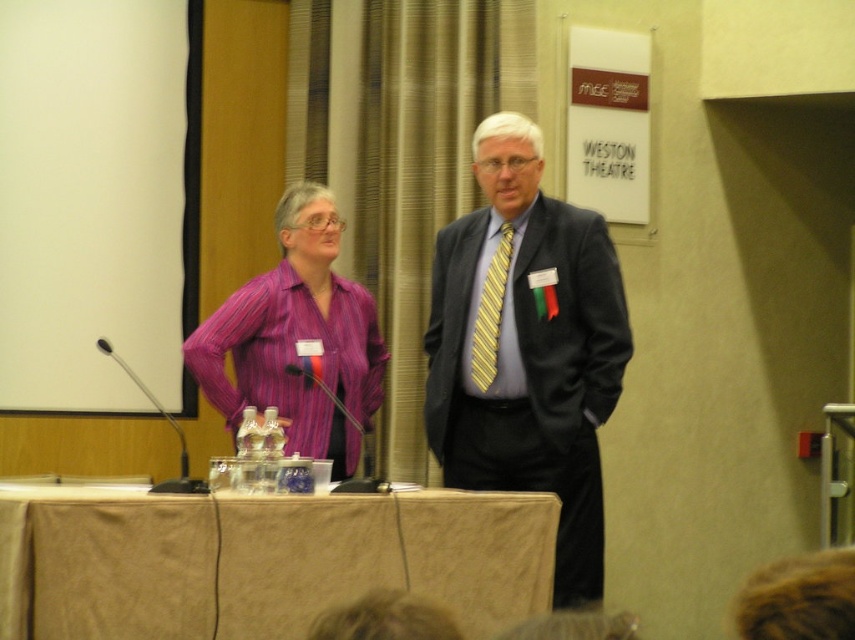
Question: Which of the following is the closest to the observer?

Choices:
 (A) matte black suit at center
 (B) yellow striped tie at center
 (C) beige fabric table at lower center

Answer: (C)

Question: Is beige fabric table at lower center below purple striped shirt at center?

Choices:
 (A) yes
 (B) no

Answer: (A)

Question: Which object appears farthest from the camera in this image?

Choices:
 (A) yellow striped tie at center
 (B) beige fabric table at lower center
 (C) purple striped shirt at center
 (D) matte black suit at center

Answer: (A)

Question: Is beige fabric table at lower center smaller than purple striped shirt at center?

Choices:
 (A) yes
 (B) no

Answer: (B)

Question: Is matte black suit at center bigger than yellow striped tie at center?

Choices:
 (A) yes
 (B) no

Answer: (A)

Question: Which object is positioned closest to the purple striped shirt at center?

Choices:
 (A) beige fabric table at lower center
 (B) matte black suit at center

Answer: (B)